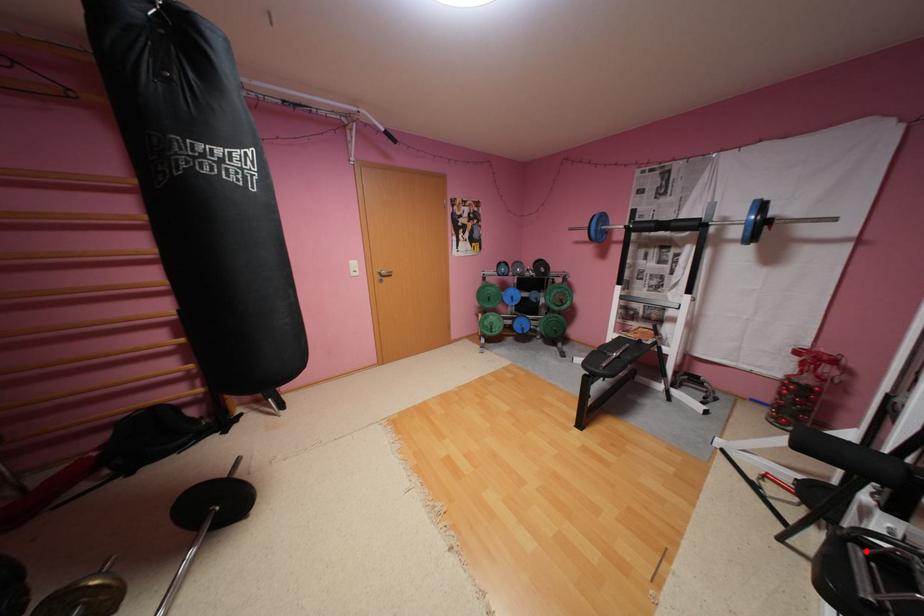
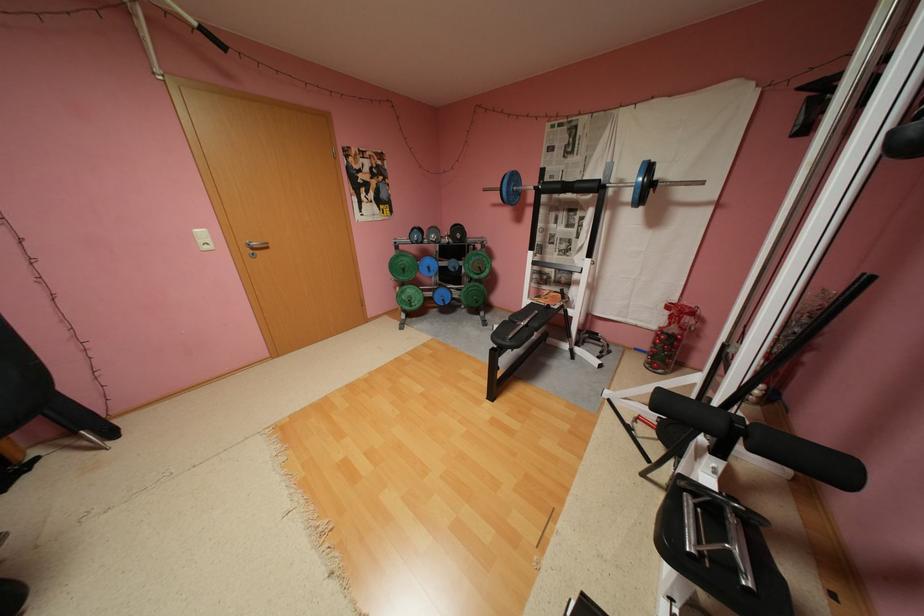
Question: A red point is marked in image1. In image2, is the corresponding 3D point closer to the camera or farther? Reply with the corresponding letter.

Choices:
 (A) The corresponding 3D point is closer.
 (B) The corresponding 3D point is farther.

Answer: (B)